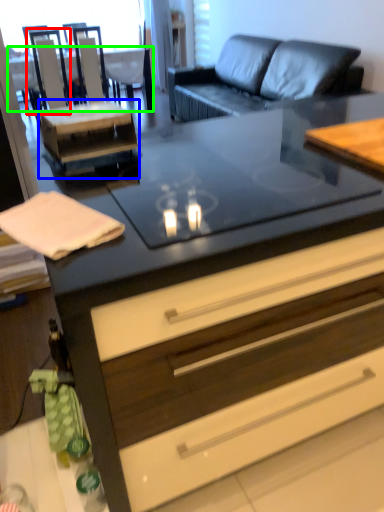
Question: Based on their relative distances, which object is farther from armchair (highlighted by a red box)? Choose from side table (highlighted by a blue box) and desk (highlighted by a green box).

Choices:
 (A) side table
 (B) desk

Answer: (B)